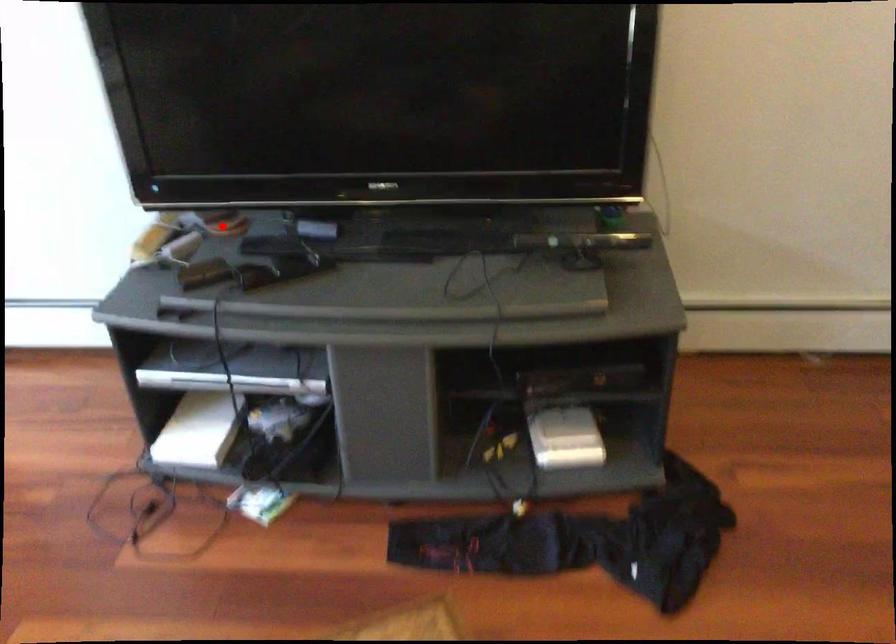
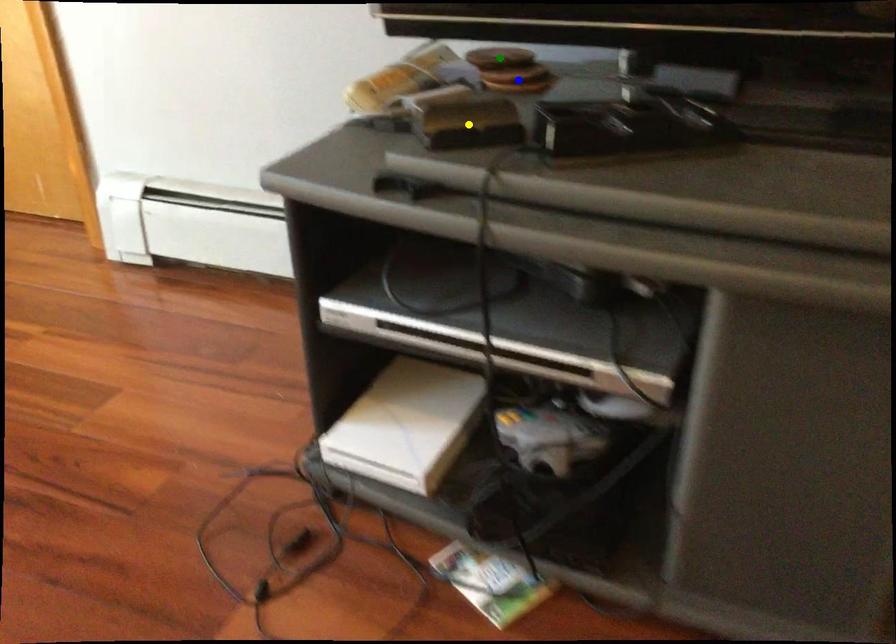
Question: I am providing you with two images of the same scene from different viewpoints. A red point is marked on the first image. You are given multiple points on the second image. Which spot in image 2 lines up with the point in image 1?

Choices:
 (A) green point
 (B) blue point
 (C) yellow point

Answer: (B)